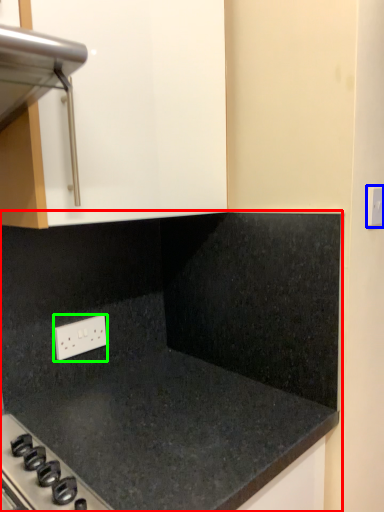
Question: Based on their relative distances, which object is nearer to countertop (highlighted by a red box)? Choose from electric outlet (highlighted by a blue box) and electric outlet (highlighted by a green box).

Choices:
 (A) electric outlet
 (B) electric outlet

Answer: (B)